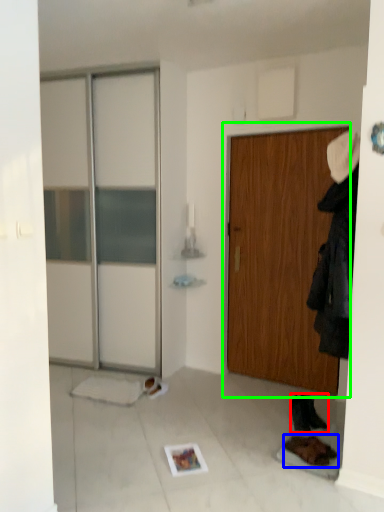
Question: Considering the real-world distances, which object is closest to footwear (highlighted by a red box)? footwear (highlighted by a blue box) or door (highlighted by a green box).

Choices:
 (A) footwear
 (B) door

Answer: (A)